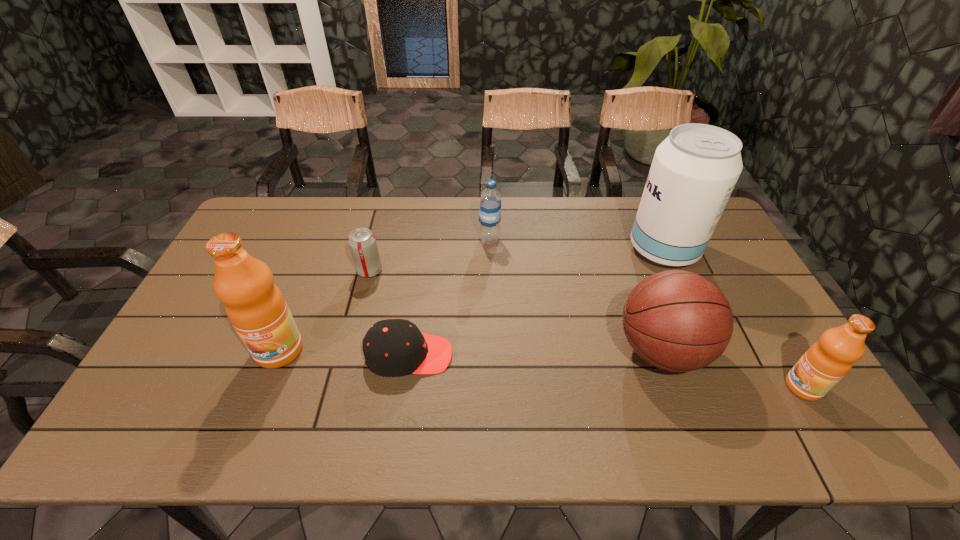
Locate an element on the screen. This screenshot has width=960, height=540. vacant region between the alcohol and the soda can is located at coordinates (516, 260).

The height and width of the screenshot is (540, 960). What are the coordinates of `vacant area between the fifth object from right to left and the shorter fruit juice` in the screenshot? It's located at (606, 371).

Identify the location of free space between the soda can and the alcohol. [516, 260].

I want to click on vacant region between the basketball and the shortest object, so point(535,353).

You are a GUI agent. You are given a task and a screenshot of the screen. Output one action in this format:
    pyautogui.click(x=<x>, y=<y>)
    Task: Click on the object that ranks as the closest to the right fruit juice
    This screenshot has height=540, width=960.
    Given the screenshot: What is the action you would take?
    pyautogui.click(x=679, y=321)

Where is `the closest object to the shortest object`? This screenshot has width=960, height=540. the closest object to the shortest object is located at coordinates (255, 306).

Where is `free spot that satisfies the following two spatial constraints: 1. on the label side of the taller fruit juice; 2. on the right side of the basketball`? free spot that satisfies the following two spatial constraints: 1. on the label side of the taller fruit juice; 2. on the right side of the basketball is located at coordinates (279, 350).